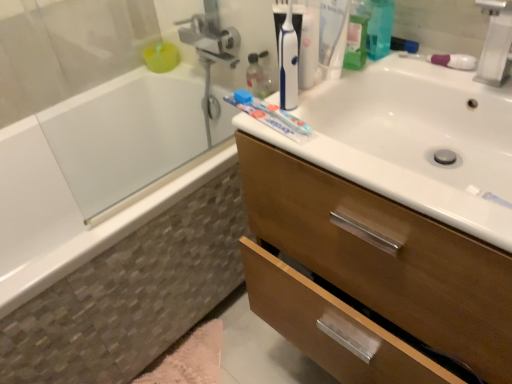
This screenshot has width=512, height=384. Find the location of `free location above pink fluffy bath mat at lower left (from a real-world perspective)`. free location above pink fluffy bath mat at lower left (from a real-world perspective) is located at coordinates (213, 362).